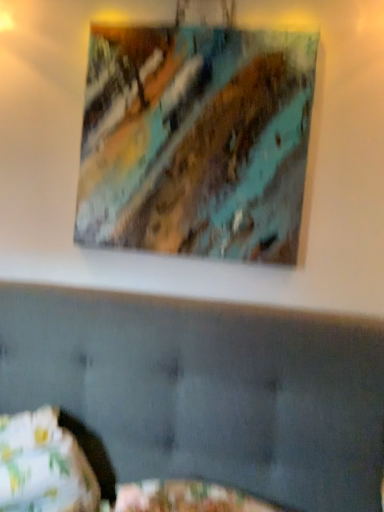
Question: Relative to fluffy fabric pillow at lower left, is matte acrylic painting at upper center in front or behind?

Choices:
 (A) behind
 (B) front

Answer: (A)

Question: From their relative heights in the image, would you say matte acrylic painting at upper center is taller or shorter than fluffy fabric pillow at lower left?

Choices:
 (A) short
 (B) tall

Answer: (B)

Question: Considering the positions of matte acrylic painting at upper center and fluffy fabric pillow at lower left in the image, is matte acrylic painting at upper center bigger or smaller than fluffy fabric pillow at lower left?

Choices:
 (A) small
 (B) big

Answer: (A)

Question: Is fluffy fabric pillow at lower left spatially inside matte acrylic painting at upper center, or outside of it?

Choices:
 (A) outside
 (B) inside

Answer: (A)

Question: Is fluffy fabric pillow at lower left wider or thinner than matte acrylic painting at upper center?

Choices:
 (A) wide
 (B) thin

Answer: (A)

Question: In terms of size, does fluffy fabric pillow at lower left appear bigger or smaller than matte acrylic painting at upper center?

Choices:
 (A) big
 (B) small

Answer: (A)

Question: Considering the positions of fluffy fabric pillow at lower left and matte acrylic painting at upper center in the image, is fluffy fabric pillow at lower left taller or shorter than matte acrylic painting at upper center?

Choices:
 (A) tall
 (B) short

Answer: (B)